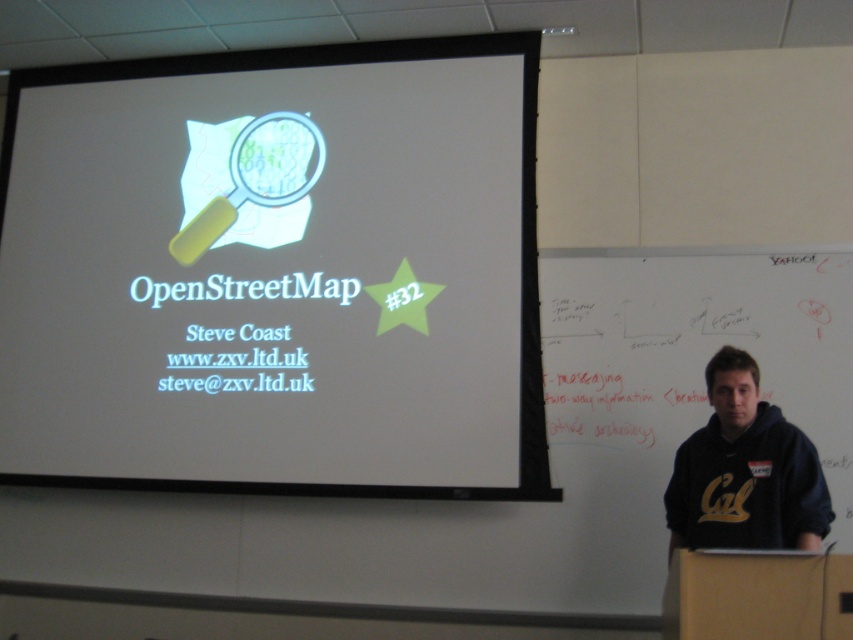
How much distance is there between white matte projection screen at upper center and dark blue hoodie at right?

3.94 feet

The height and width of the screenshot is (640, 853). What are the coordinates of `white matte projection screen at upper center` in the screenshot? It's located at (276, 272).

What do you see at coordinates (276, 272) in the screenshot?
I see `white matte projection screen at upper center` at bounding box center [276, 272].

Where is `white matte projection screen at upper center`? white matte projection screen at upper center is located at coordinates (276, 272).

Who is shorter, white matte projection screen at upper center or whiteboard at right?

whiteboard at right

Is the position of white matte projection screen at upper center more distant than that of whiteboard at right?

Yes, it is.

Measure the distance between point (115, 426) and camera.

Point (115, 426) is 3.48 meters from camera.

Locate an element on the screen. This screenshot has height=640, width=853. white matte projection screen at upper center is located at coordinates (276, 272).

Who is positioned more to the left, whiteboard at right or dark blue hoodie at right?

dark blue hoodie at right

Between point (618, 394) and point (773, 490), which one is positioned behind?

The point (618, 394) is behind.

This screenshot has width=853, height=640. I want to click on whiteboard at right, so click(688, 365).